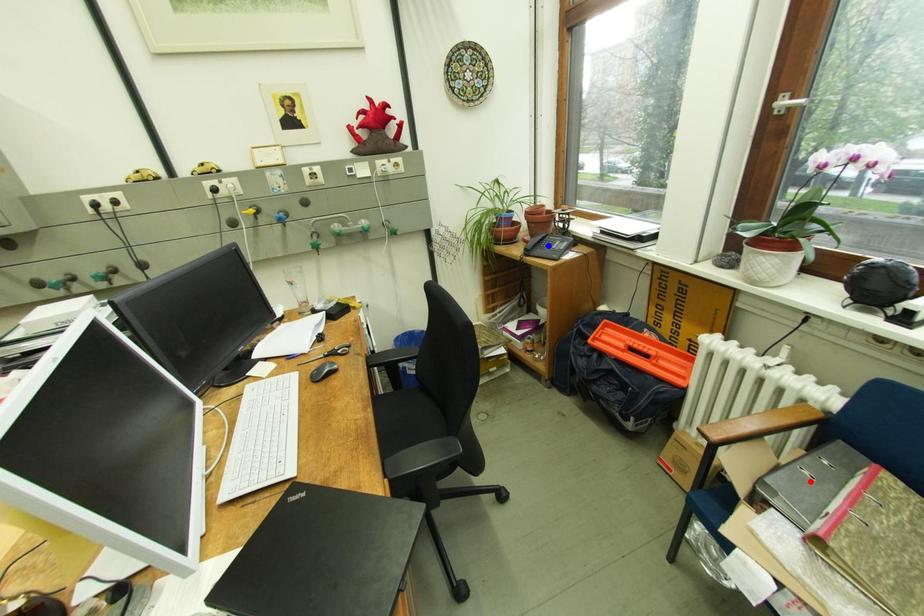
Question: Which of the two points in the image is closer to the camera?

Choices:
 (A) Blue point is closer.
 (B) Red point is closer.

Answer: (B)